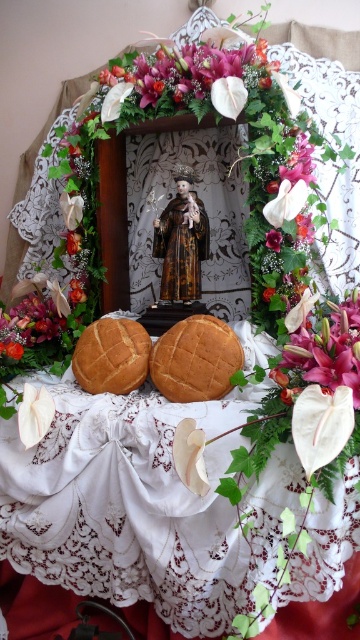
Can you confirm if pink silk flower at upper right is bigger than purple glossy flower at center?

Yes.

From the picture: Is pink silk flower at upper right thinner than purple glossy flower at center?

Incorrect, pink silk flower at upper right's width is not less than purple glossy flower at center's.

Which is in front, point (299, 381) or point (281, 241)?

Point (299, 381)

Locate an element on the screen. The height and width of the screenshot is (640, 360). pink silk flower at upper right is located at coordinates (322, 353).

Identify the location of golden brown crumbly bread at center. This screenshot has height=640, width=360. (195, 358).

Does point (186, 353) come in front of point (133, 355)?

Yes, it is in front of point (133, 355).

Find the location of a particular element. The height and width of the screenshot is (640, 360). golden brown crumbly bread at center is located at coordinates (195, 358).

In the scene shown: Can you confirm if golden brown crumbly bread at center is smaller than purple glossy flower at center?

No.

Between point (171, 401) and point (280, 230), which one is positioned in front?

Point (171, 401)

Is point (237, 349) farther from viewer compared to point (272, 237)?

No, it is in front of (272, 237).

You are a GUI agent. You are given a task and a screenshot of the screen. Output one action in this format:
    pyautogui.click(x=<x>, y=<y>)
    Task: Click on the golden brown crumbly bread at center
    
    Given the screenshot: What is the action you would take?
    pyautogui.click(x=195, y=358)